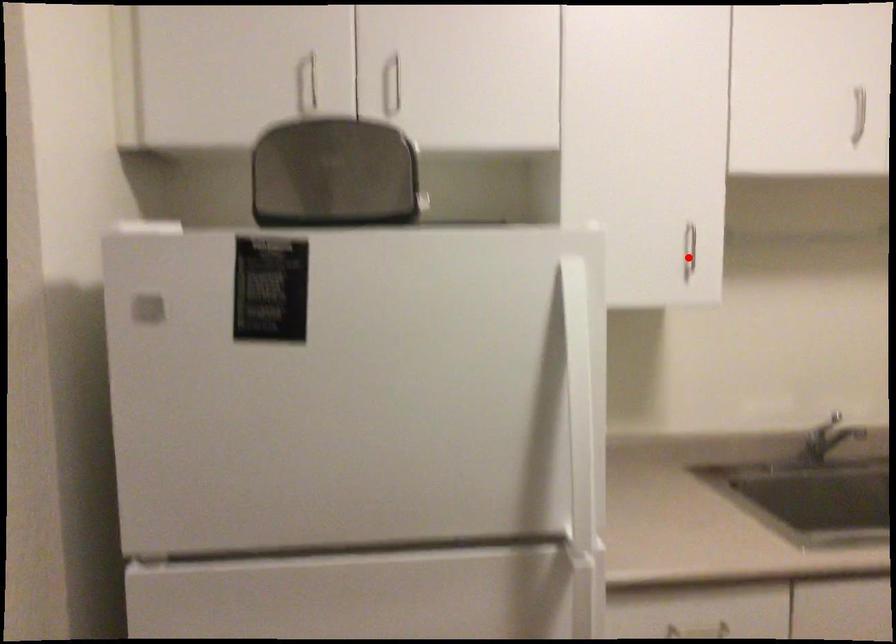
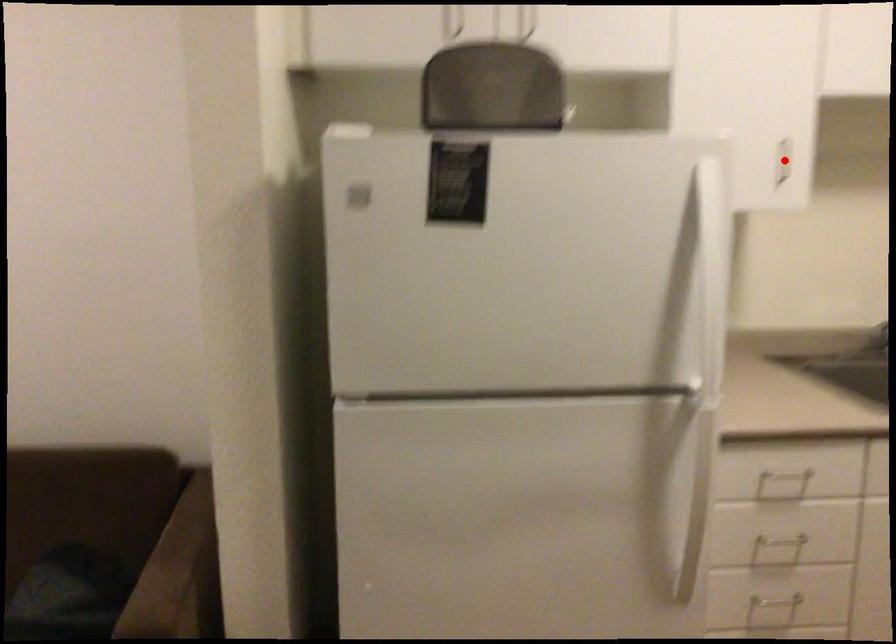
I am providing you with two images of the same scene from different viewpoints. A red point is marked on the first image and another point is marked on the second image. Are the points marked in image1 and image2 representing the same 3D position?

Yes